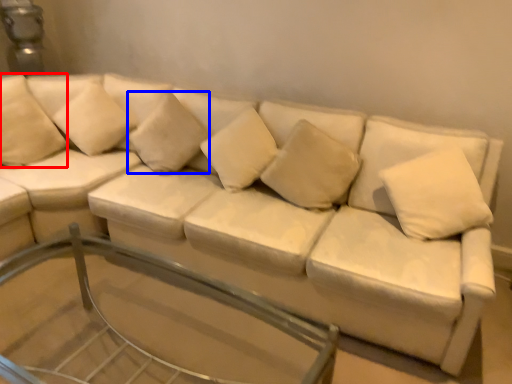
Question: Which point is closer to the camera, pillow (highlighted by a red box) or pillow (highlighted by a blue box)?

Choices:
 (A) pillow
 (B) pillow

Answer: (B)